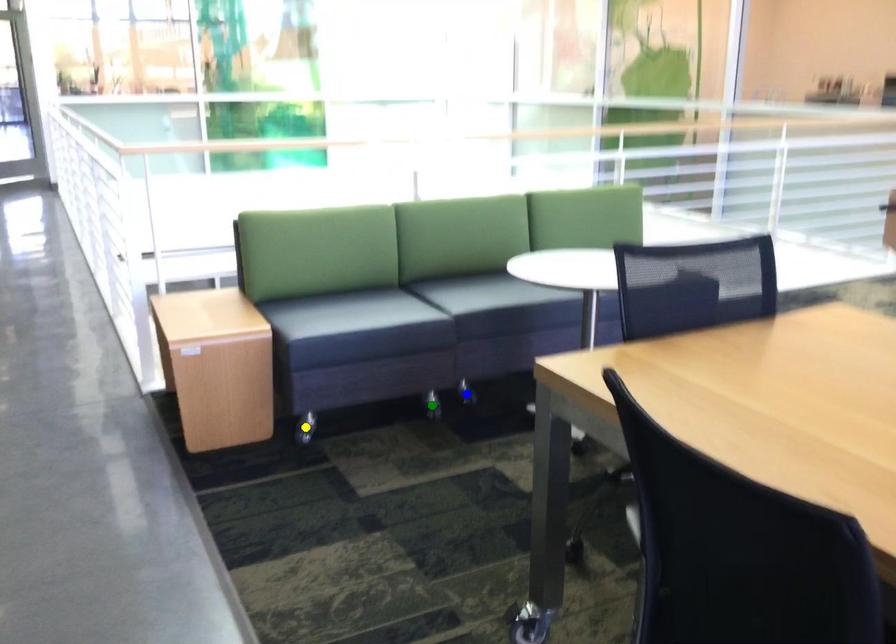
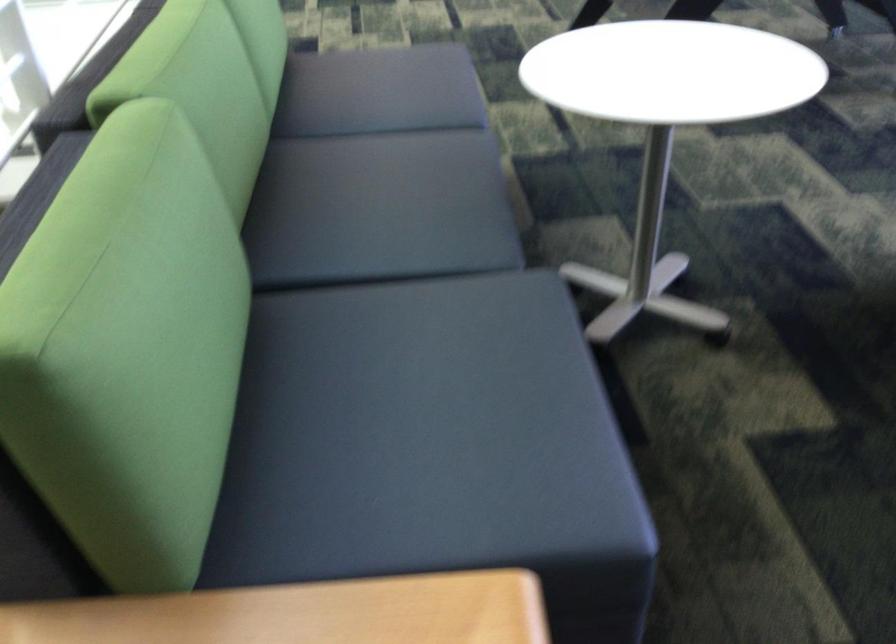
I am providing you with two images of the same scene from different viewpoints. Three points are marked in image1. Which point corresponds to a part or object that is occluded in image2?In image1, three points are marked. Which of them correspond to a part or object that is occluded in image2?Among the three points shown in image1, which one corresponds to a part or object that is no longer visible due to occlusion in image2?

Invisible in image2: green point, blue point, yellow point.